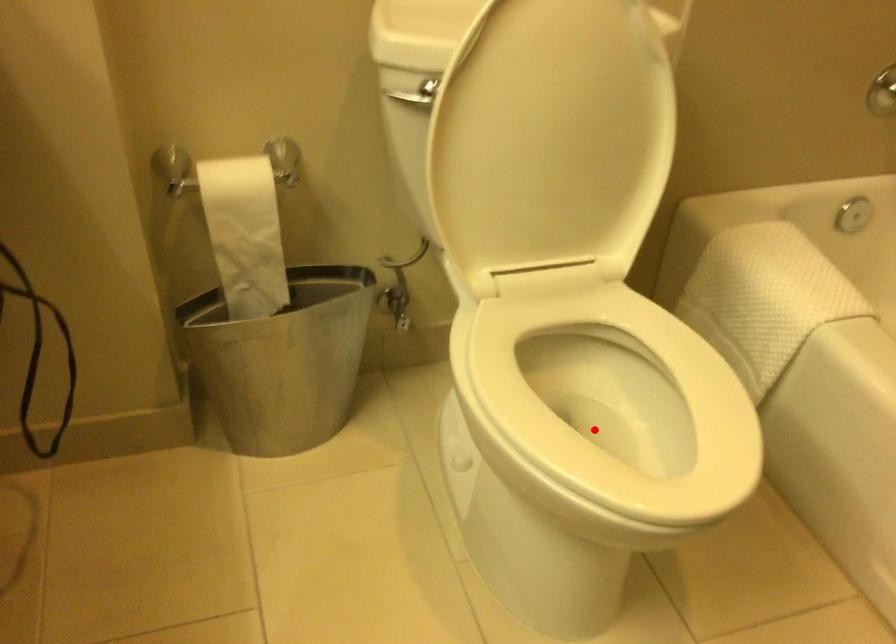
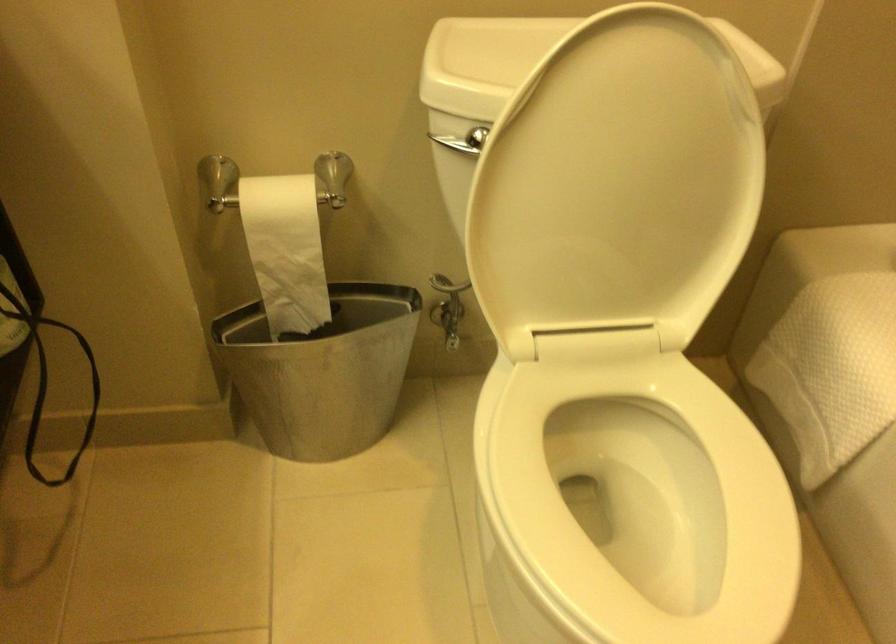
In the second image, find the point that corresponds to the highlighted location in the first image.

(630, 504)